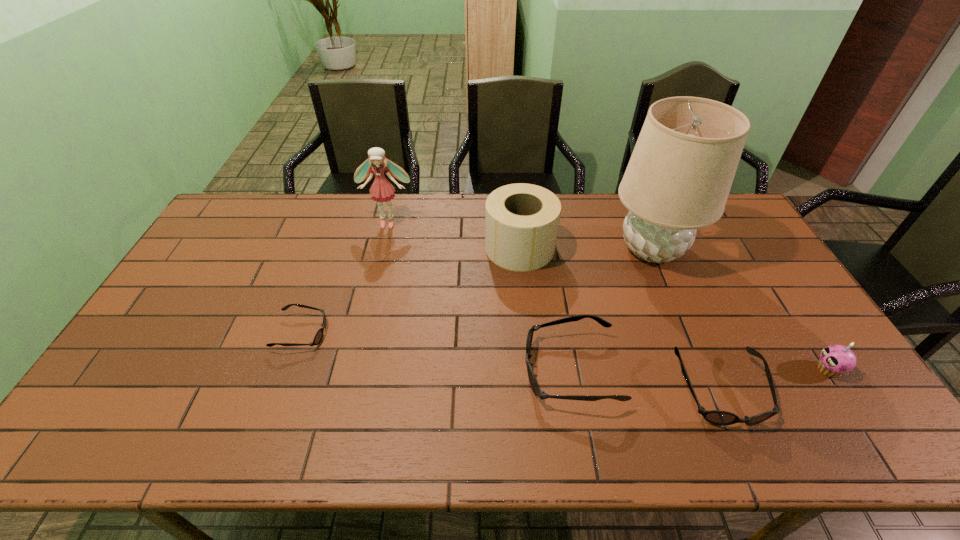
Where is `the rightmost object`? The image size is (960, 540). the rightmost object is located at coordinates (835, 360).

Identify the location of vacant space located 0.120m on the lenses of the shortest sunglasses. (370, 333).

Locate an element on the screen. Image resolution: width=960 pixels, height=540 pixels. free space located on the lenses of the second sunglasses from left to right is located at coordinates (466, 370).

Locate an element on the screen. Image resolution: width=960 pixels, height=540 pixels. blank space located on the lenses of the second sunglasses from left to right is located at coordinates (393, 370).

Identify the location of blank space located 0.370m on the lenses of the second sunglasses from left to right. Image resolution: width=960 pixels, height=540 pixels. (381, 370).

Locate an element on the screen. vacant space located 0.330m on the front-facing side of the sixth object from right to left is located at coordinates (370, 300).

Where is `free space located on the left of the lampshade`? The width and height of the screenshot is (960, 540). free space located on the left of the lampshade is located at coordinates (540, 249).

Identify the location of free point located on the front of the third tallest object. This screenshot has width=960, height=540. (524, 295).

What are the coordinates of `vacant space located on the face of the fourth shortest object` in the screenshot? It's located at (691, 369).

Identify the location of blank space located on the face of the fourth shortest object. The height and width of the screenshot is (540, 960). (668, 369).